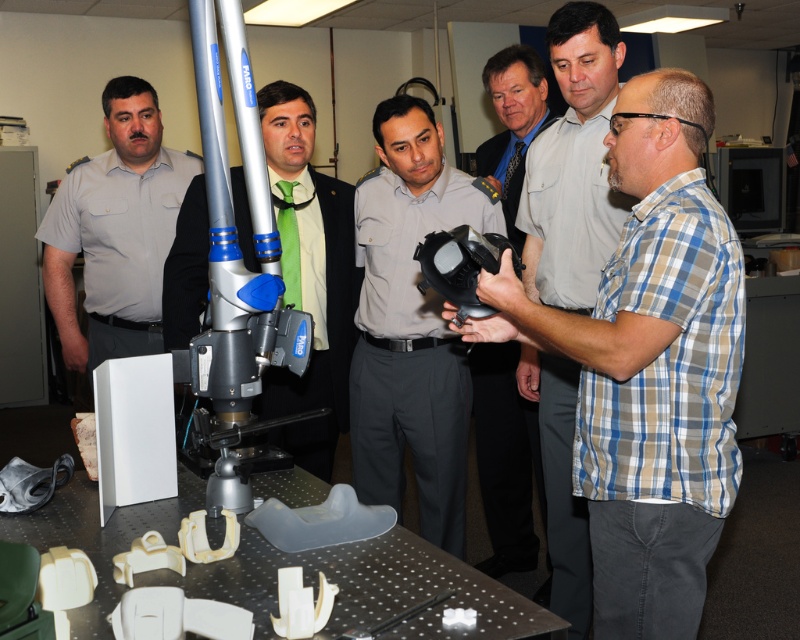
In the scene shown: Where is the plaid shirt at center located in the image?

The plaid shirt at center is located at the point with coordinates 0.573 in the x axis and 0.812 in the y axis.

You are an office assistant who needs to place the green silk tie at center and the matte black helmet at center into a storage box. The box can only hold items that are smaller than the helmet. Can both items fit?

The green silk tie at center has a smaller size compared to matte black helmet at center, so the tie will fit in the box. However, the matte black helmet at center may not fit since it is larger than the tie and the box can only hold items smaller than the helmet.